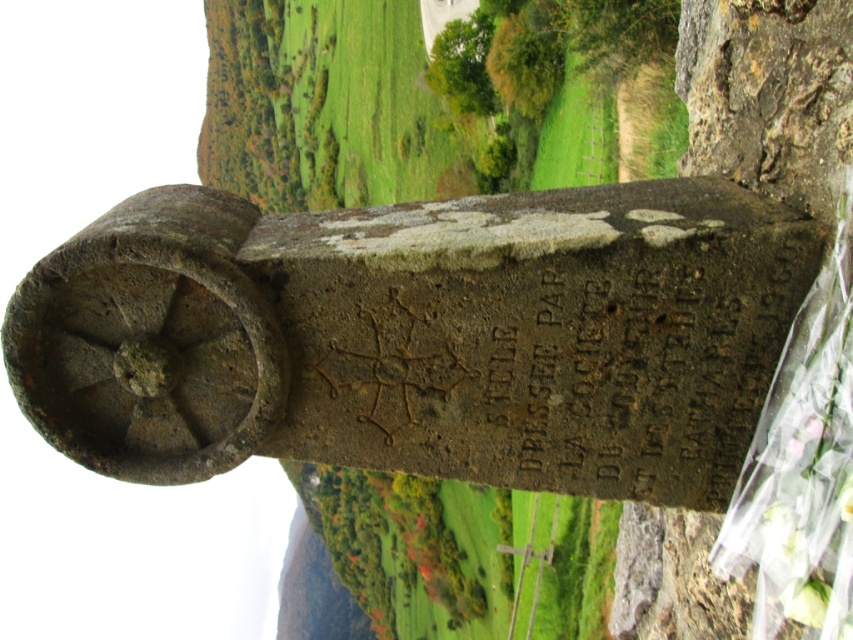
Question: Does rusty stone gravestone at center lie behind smooth brown stone at right?

Choices:
 (A) yes
 (B) no

Answer: (B)

Question: Where is rusty stone gravestone at center located in relation to smooth brown stone at right in the image?

Choices:
 (A) above
 (B) below

Answer: (A)

Question: Which object appears farthest from the camera in this image?

Choices:
 (A) rusty stone gravestone at center
 (B) smooth brown stone at right

Answer: (B)

Question: Does rusty stone gravestone at center appear on the right side of smooth brown stone at right?

Choices:
 (A) no
 (B) yes

Answer: (A)

Question: Which object appears farthest from the camera in this image?

Choices:
 (A) smooth brown stone at right
 (B) rusty stone gravestone at center

Answer: (A)